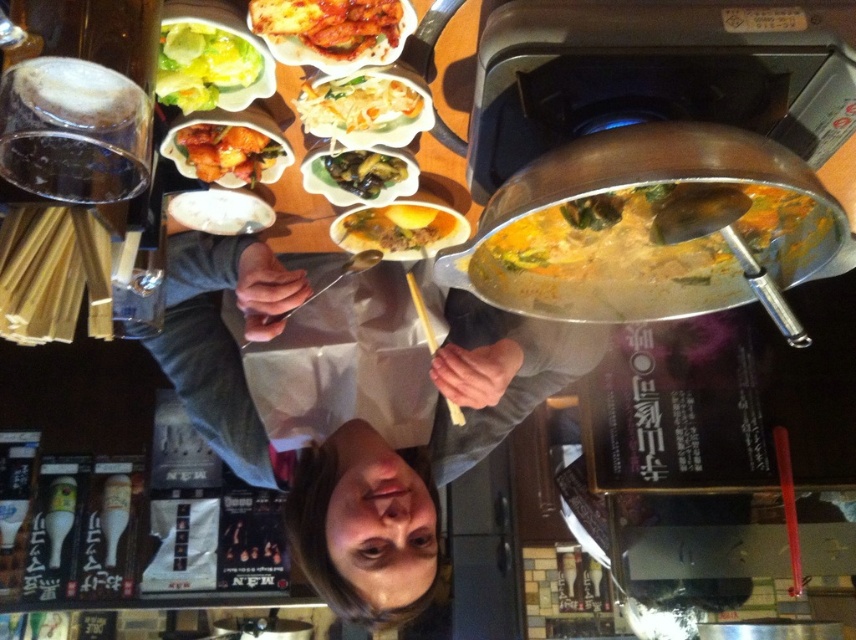
You are a food critic visiting this hot pot restaurant. You notice two dishes on the table, the glazed glossy chicken at upper center and the green leafy lettuce at upper left. Which dish would you describe as the smaller one based on their sizes?

The glazed glossy chicken at upper center is smaller than the green leafy lettuce at upper left, so the smaller dish is the glazed glossy chicken at upper center.

You are a server at the hot pot restaurant and need to place a 10.5 inch wide tray on the table between the smooth gray sweater at center and the yellow creamy soup at center. Will the tray fit between them?

The smooth gray sweater at center is 10.11 inches from the yellow creamy soup at center. Since the tray is 10.5 inches wide, it is slightly wider than the space available, so the tray will not fit between them.

You are a food critic who wants to taste both the white creamy noodles at center and the green glossy vegetables at center. Since you have limited space on your plate, which one should you choose to take a bigger portion of to ensure it fits?

The white creamy noodles at center has a larger size compared to the green glossy vegetables at center, so you should take a bigger portion of the white creamy noodles at center to ensure it fits on your plate.